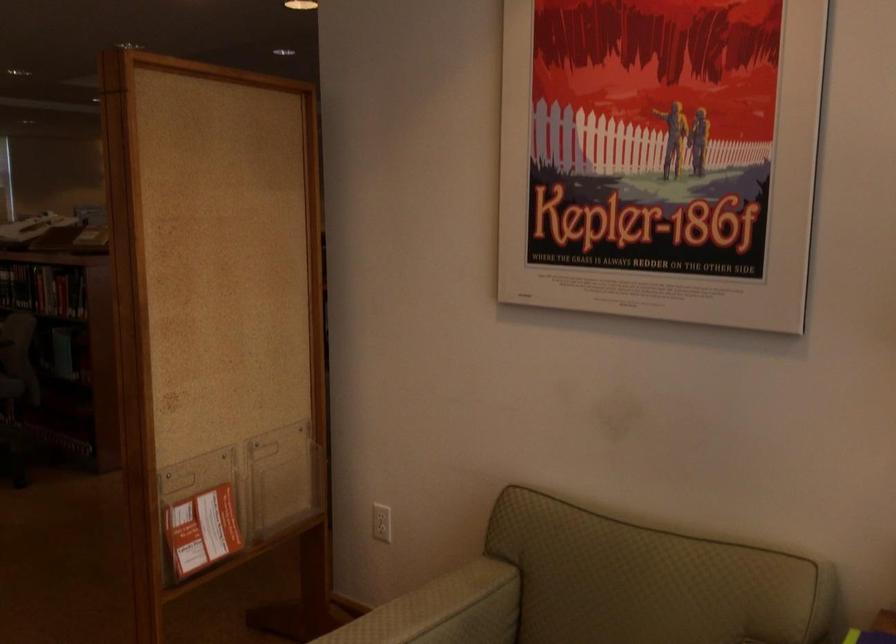
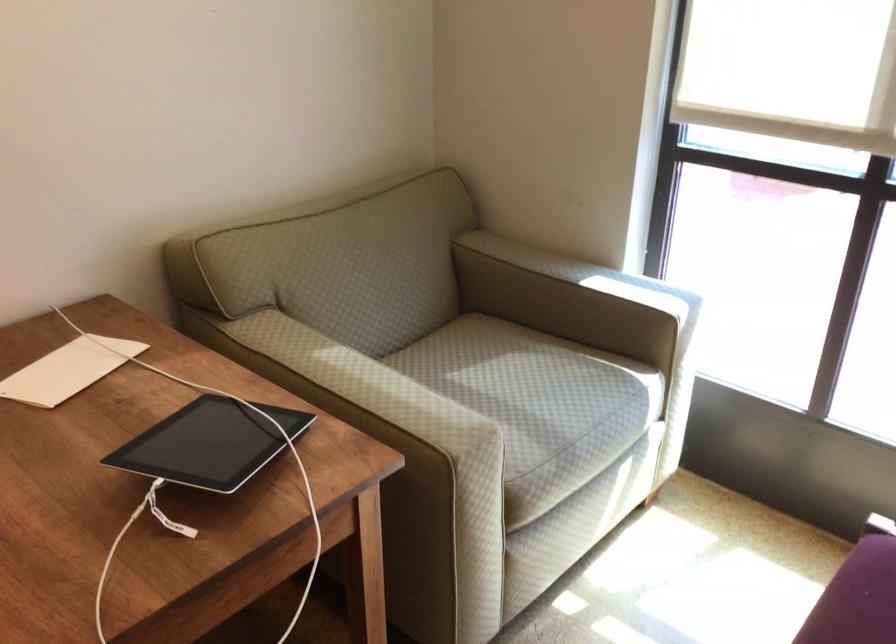
Based on the continuous images, in which direction is the camera rotating?

The camera rotated toward right-down.